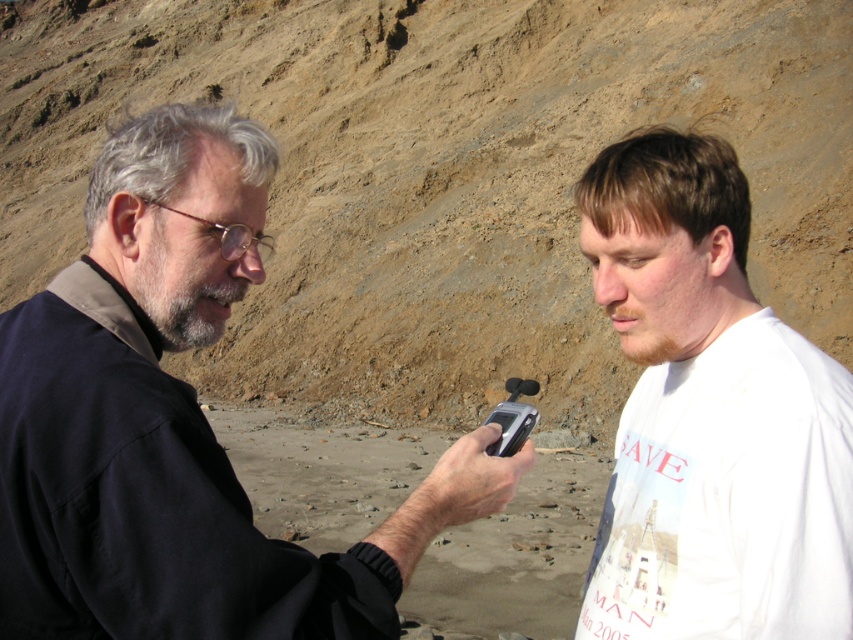
Based on the photo, you are standing at the point with coordinates point [624,237] and want to walk to the point with coordinates point [24,593]. Which direction should you move?

You should move forward because point [24,593] is in front of point [624,237].